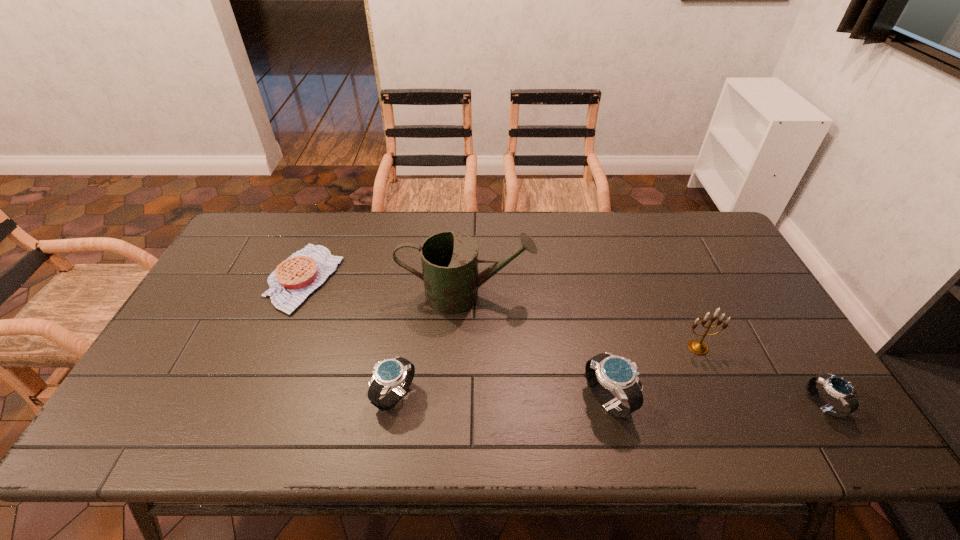
In the image, there is a desktop. Where is `free space at the far edge`? This screenshot has width=960, height=540. free space at the far edge is located at coordinates (455, 212).

Find the location of a particular element. Image resolution: width=960 pixels, height=540 pixels. vacant area at the near edge is located at coordinates (542, 406).

Where is `free point at the left edge`? The height and width of the screenshot is (540, 960). free point at the left edge is located at coordinates click(238, 305).

Where is `vacant point at the right edge`? The image size is (960, 540). vacant point at the right edge is located at coordinates (741, 345).

Where is `vacant area between the watering can and the fourth tallest object`? vacant area between the watering can and the fourth tallest object is located at coordinates (431, 345).

This screenshot has width=960, height=540. I want to click on free space that is in between the third object from right to left and the watering can, so click(537, 347).

Where is `free point between the second watch from right to left and the shortest object`? Image resolution: width=960 pixels, height=540 pixels. free point between the second watch from right to left and the shortest object is located at coordinates coord(455,339).

In order to click on vacant area that lies between the third farthest object and the second shortest watch in this screenshot , I will do `click(546, 372)`.

At what (x,y) coordinates should I click in order to perform the action: click on unoccupied position between the shortest object and the watering can. Please return your answer as a coordinate pair (x, y). This screenshot has height=540, width=960. Looking at the image, I should click on (385, 286).

You are a GUI agent. You are given a task and a screenshot of the screen. Output one action in this format:
    pyautogui.click(x=<x>, y=<y>)
    Task: Click on the free space between the fifth tallest object and the shortest object
    
    Given the screenshot: What is the action you would take?
    pyautogui.click(x=564, y=342)